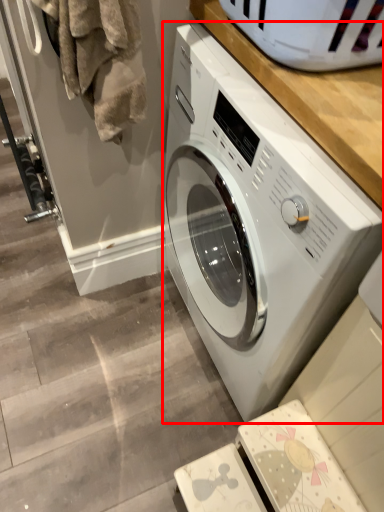
Question: From the image's perspective, what is the correct spatial relationship of washing machine (annotated by the red box) in relation to laundry?

Choices:
 (A) below
 (B) above

Answer: (A)